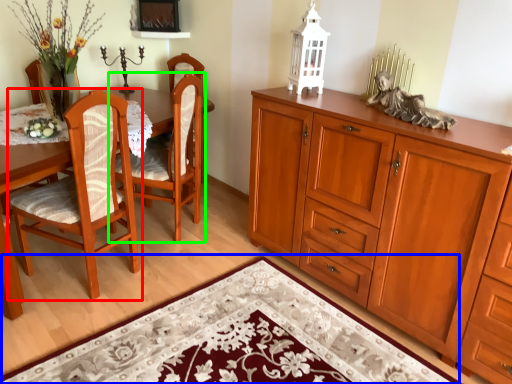
Question: Considering the real-world distances, which object is farthest from chair (highlighted by a red box)? doormat (highlighted by a blue box) or chair (highlighted by a green box)?

Choices:
 (A) doormat
 (B) chair

Answer: (A)